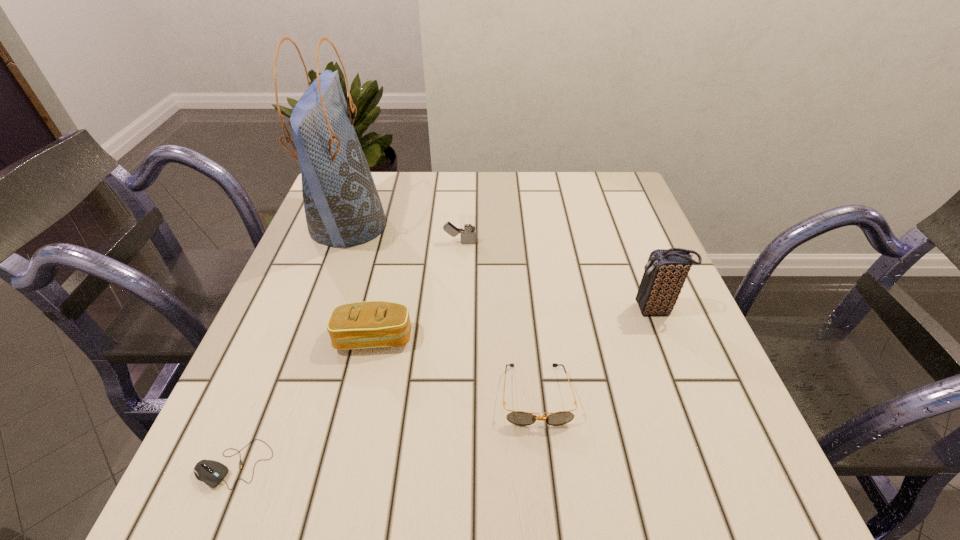
Where is `shopping bag that is at the left edge`? This screenshot has height=540, width=960. shopping bag that is at the left edge is located at coordinates (342, 206).

I want to click on clutch bag that is at the left edge, so click(x=372, y=324).

This screenshot has width=960, height=540. Identify the location of computer mouse present at the left edge. (211, 472).

Find the location of a particular element. object positioned at the right edge is located at coordinates (666, 271).

Identify the location of object at the far left corner. (342, 206).

Find the location of a particular element. The image size is (960, 540). object at the near left corner is located at coordinates (211, 472).

The width and height of the screenshot is (960, 540). In the image, there is a desktop. Identify the location of free space at the far edge. (488, 176).

In the image, there is a desktop. Where is `blank space at the near edge`? blank space at the near edge is located at coordinates (527, 468).

This screenshot has width=960, height=540. In the image, there is a desktop. In order to click on vacant space at the left edge in this screenshot , I will do (360, 254).

The width and height of the screenshot is (960, 540). Identify the location of vacant region at the right edge. (644, 400).